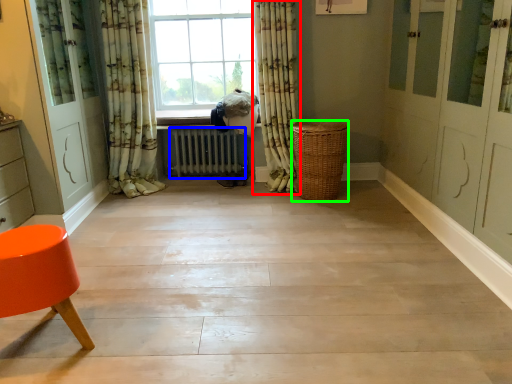
Question: Estimate the real-world distances between objects in this image. Which object is closer to curtain (highlighted by a red box), radiator (highlighted by a blue box) or basket (highlighted by a green box)?

Choices:
 (A) radiator
 (B) basket

Answer: (B)